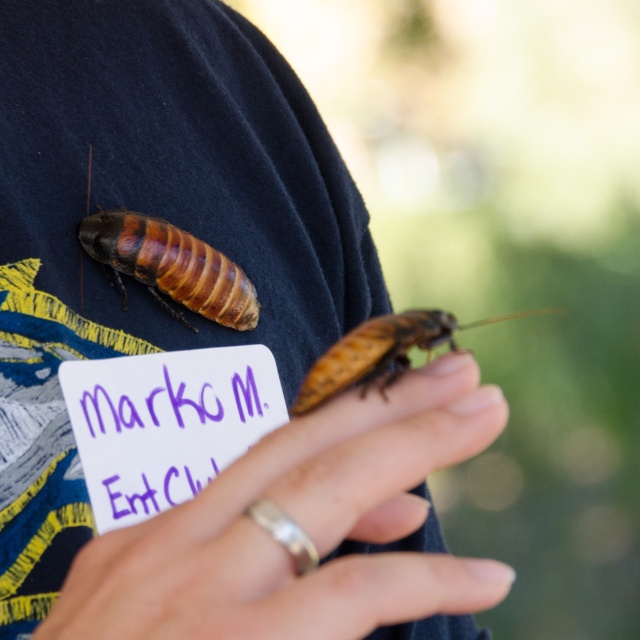
Between smooth skin hand at center and brown shiny cockroach at center, which one is positioned higher?

brown shiny cockroach at center is higher up.

Can you confirm if smooth skin hand at center is thinner than brown shiny cockroach at center?

No, smooth skin hand at center is not thinner than brown shiny cockroach at center.

This screenshot has height=640, width=640. What are the coordinates of `smooth skin hand at center` in the screenshot? It's located at (301, 529).

Does point (372, 435) come behind point (176, 285)?

No, (372, 435) is in front of (176, 285).

Does smooth skin hand at center have a larger size compared to brown shiny cockroach at upper left?

Indeed, smooth skin hand at center has a larger size compared to brown shiny cockroach at upper left.

Between point (300, 624) and point (253, 305), which one is positioned behind?

The point (253, 305) is behind.

I want to click on smooth skin hand at center, so click(301, 529).

Can you confirm if brown shiny cockroach at upper left is positioned above brown shiny cockroach at center?

Yes.

Does point (195, 289) come behind point (408, 349)?

Yes, it is behind point (408, 349).

You are a GUI agent. You are given a task and a screenshot of the screen. Output one action in this format:
    pyautogui.click(x=<x>, y=<y>)
    Task: Click on the brown shiny cockroach at upper left
    
    Given the screenshot: What is the action you would take?
    pyautogui.click(x=168, y=264)